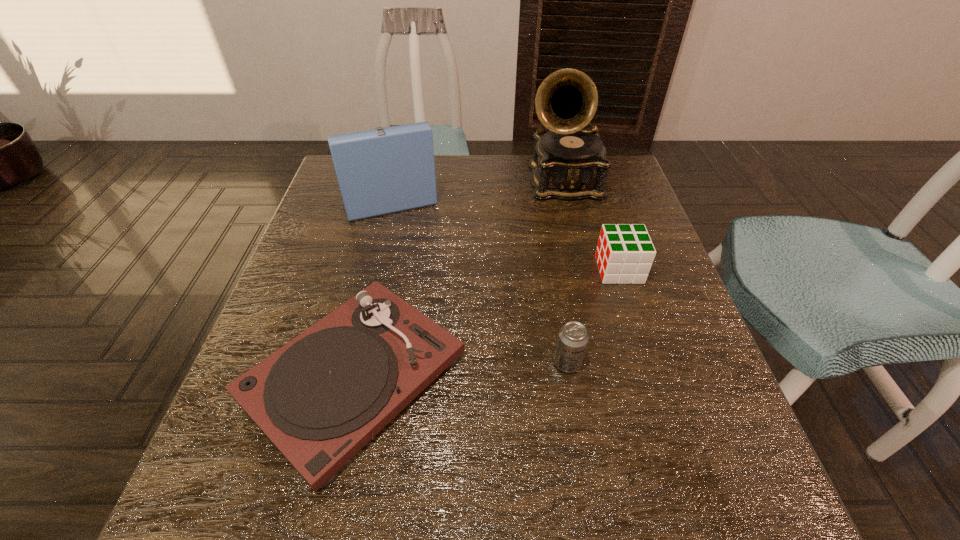
The image size is (960, 540). Find the location of `vacant space located 0.120m on the red face of the cube`. vacant space located 0.120m on the red face of the cube is located at coordinates (544, 269).

Where is `free space located 0.130m on the red face of the cube`? The image size is (960, 540). free space located 0.130m on the red face of the cube is located at coordinates [x=540, y=269].

Locate an element on the screen. The image size is (960, 540). vacant space situated 0.050m on the red face of the cube is located at coordinates (576, 269).

The height and width of the screenshot is (540, 960). I want to click on free point located on the back of the shortest object, so click(x=393, y=209).

Where is `object that is at the near edge`? object that is at the near edge is located at coordinates (320, 398).

This screenshot has width=960, height=540. I want to click on phonograph record situated at the right edge, so click(x=569, y=163).

Locate an element on the screen. The height and width of the screenshot is (540, 960). cube that is at the right edge is located at coordinates (624, 254).

Locate an element on the screen. object present at the far left corner is located at coordinates (381, 171).

Locate an element on the screen. object located in the near left corner section of the desktop is located at coordinates (320, 398).

Locate an element on the screen. The height and width of the screenshot is (540, 960). object that is at the far right corner is located at coordinates (569, 163).